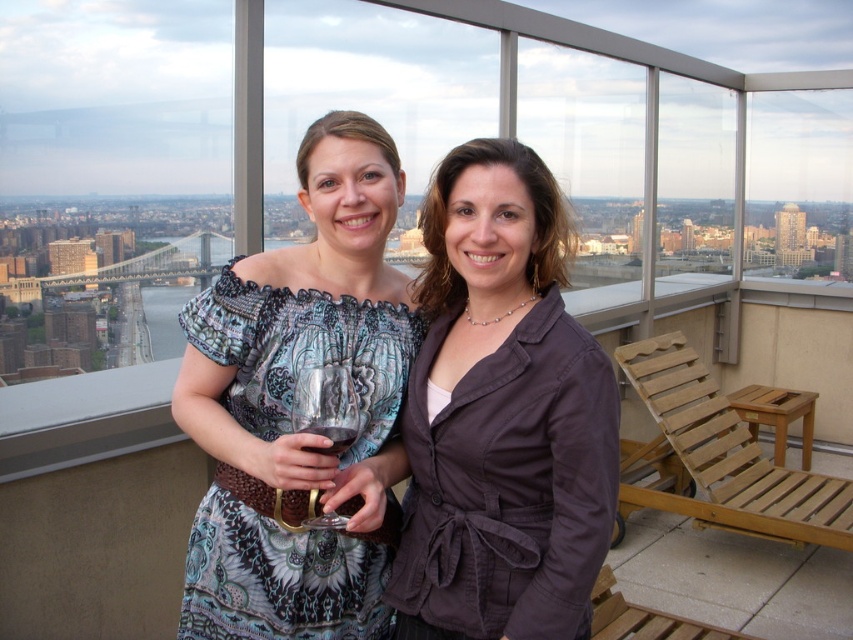
The image size is (853, 640). I want to click on matte brown blazer at center, so click(502, 416).

Between matte brown blazer at center and translucent glass at center, which one is positioned lower?

translucent glass at center is below.

Does point (502, 516) come behind point (326, 426)?

No.

Identify the location of matte brown blazer at center. (502, 416).

Is matte brown blazer at center above patterned fabric dress at center?

Actually, matte brown blazer at center is below patterned fabric dress at center.

Where is `matte brown blazer at center`? Image resolution: width=853 pixels, height=640 pixels. matte brown blazer at center is located at coordinates (502, 416).

What do you see at coordinates (502, 416) in the screenshot? The width and height of the screenshot is (853, 640). I see `matte brown blazer at center` at bounding box center [502, 416].

Locate an element on the screen. This screenshot has height=640, width=853. matte brown blazer at center is located at coordinates (502, 416).

Which is more to the left, transparent glass at center or translucent glass at center?

Positioned to the left is translucent glass at center.

Can you confirm if transparent glass at center is positioned to the left of translucent glass at center?

No, transparent glass at center is not to the left of translucent glass at center.

Where is `transparent glass at center`? transparent glass at center is located at coordinates (326, 404).